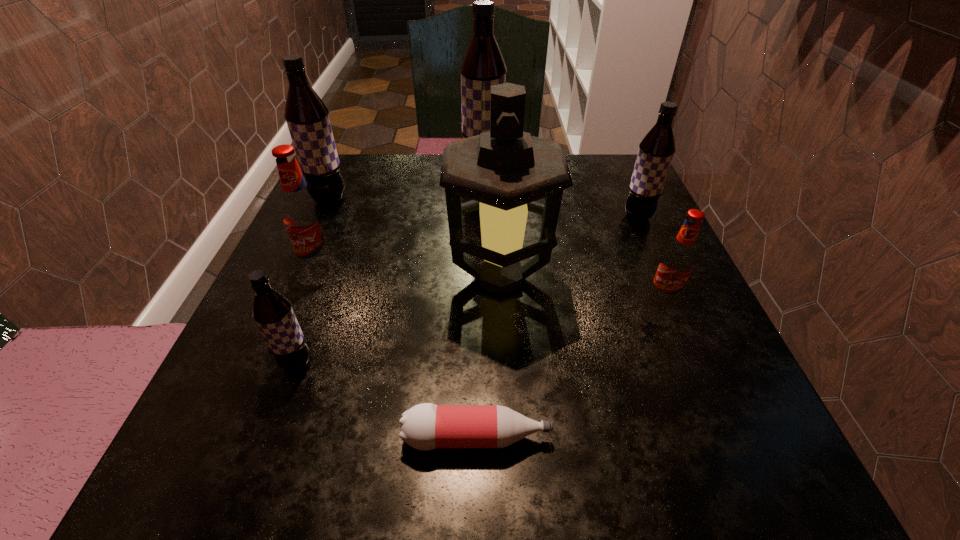
Choose which brown root beer is the fourth nearest neighbor to the nearer red root beer. Please provide its 2D coordinates. Your answer should be formatted as a tuple, i.e. [(x, y)], where the tuple contains the x and y coordinates of a point satisfying the conditions above.

[(307, 117)]

This screenshot has width=960, height=540. I want to click on the third closest brown root beer to the oil lamp, so click(x=483, y=66).

Image resolution: width=960 pixels, height=540 pixels. In order to click on free space that satisfies the following two spatial constraints: 1. on the front side of the oil lamp; 2. on the left side of the farther red root beer in this screenshot , I will do `click(316, 279)`.

Image resolution: width=960 pixels, height=540 pixels. Identify the location of free space that satisfies the following two spatial constraints: 1. on the front side of the oil lamp; 2. on the right side of the bigger red root beer. (316, 279).

Identify the location of free space that satisfies the following two spatial constraints: 1. on the back side of the rightmost brown root beer; 2. on the right side of the third nearest root beer. The image size is (960, 540). (341, 216).